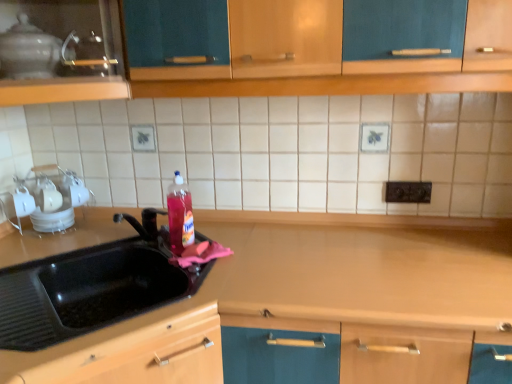
Find the location of a particular element. The width and height of the screenshot is (512, 384). free spot below glass teapot at upper left, which ranks as the 2th appliance in back-to-front order (from a real-world perspective) is located at coordinates (68, 240).